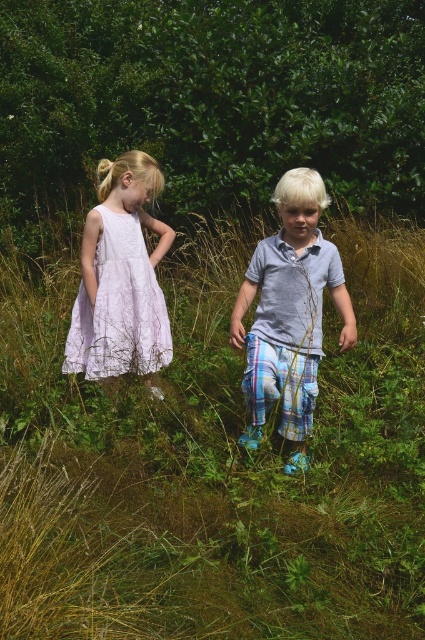
You are a photographer standing in front of the two children. You want to take a photo that focuses on the green grassy at center while making sure the light blue plaid pants at center is still visible but not too prominent. Which child should you position closer to the camera?

The green grassy at center is closer to the viewer than the light blue plaid pants at center. Therefore, to focus on the green grassy at center and keep the light blue plaid pants at center less prominent, you should position the child wearing the light blue plaid pants at center farther away from the camera so the grass remains closer and the pants are slightly farther back.

You are a photographer trying to capture a photo of the green grassy at center and the lavender lace dress at left. Which object should you focus on first to ensure both are in focus?

You should focus on the green grassy at center first because it is closer to the viewer than the lavender lace dress at left. By focusing on the closer object, the lavender lace dress at left will naturally fall into the depth of field, ensuring both are in focus.